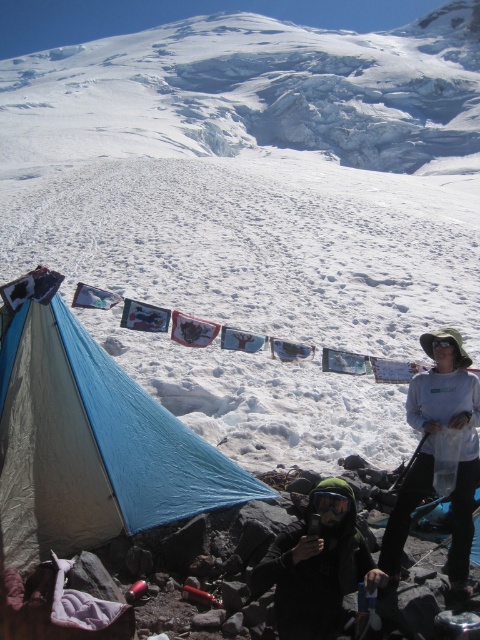
Question: Which of the following is the closest to the observer?

Choices:
 (A) (440, 400)
 (B) (321, 515)
 (C) (99, 460)

Answer: (B)

Question: Which of the following is the closest to the observer?

Choices:
 (A) (36, 340)
 (B) (429, 465)

Answer: (A)

Question: Estimate the real-world distances between objects in this image. Which object is closer to the blue fabric tent at lower left?

Choices:
 (A) black matte helmet at lower center
 (B) white cotton shirt at right

Answer: (A)

Question: Is blue fabric tent at lower left bigger than black matte helmet at lower center?

Choices:
 (A) no
 (B) yes

Answer: (B)

Question: Where is blue fabric tent at lower left located in relation to black matte helmet at lower center in the image?

Choices:
 (A) below
 (B) above

Answer: (B)

Question: Is blue fabric tent at lower left below black matte helmet at lower center?

Choices:
 (A) no
 (B) yes

Answer: (A)